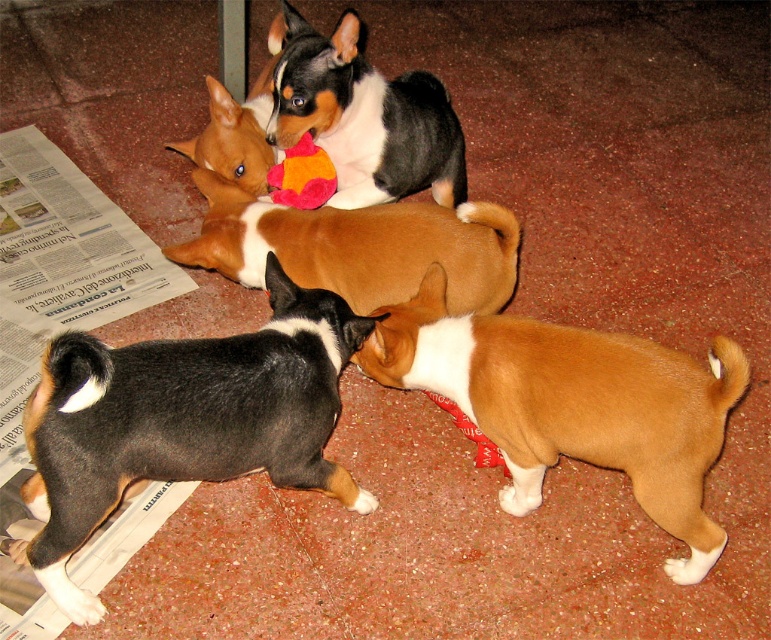
You are a dog trainer observing the Basenji puppies. You notice the black and tan fur at lower left and the soft plush toy at center. Which object takes up more space in the image?

The black and tan fur at lower left is bigger than the soft plush toy at center, so it takes up more space in the image.

Based on the scene description, which puppy has a taller fur height between the black and tan fur at lower left and the black and white fur at center?

The black and tan fur at lower left is taller than the black and white fur at center.

Based on the photo, you are a dog trainer observing the Basenji puppies. You need to place a treat between the brown furry puppy at center and the black and white fur at center so both can reach it. How far apart should you place the treat from each puppy?

The brown furry puppy at center is 71.42 centimeters away from black and white fur at center. To ensure both puppies can reach the treat, place it exactly halfway between them, which would be 35.71 centimeters from each puppy.